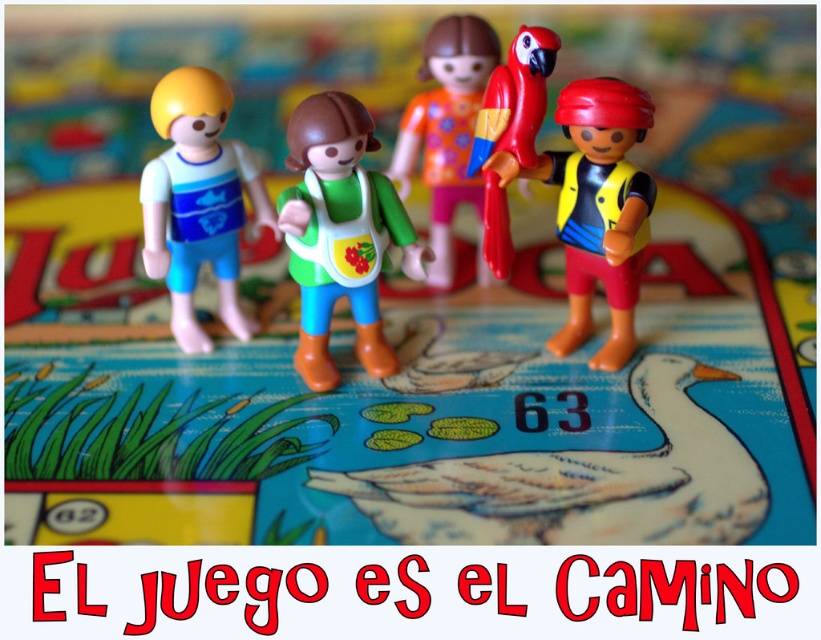
You are playing a board game and need to place a token between the green matte vest at center and the matte plastic doll at center. Which object should you place the token closer to if you want it to be nearer to the front of the scene?

The green matte vest at center is closer to the viewer than the matte plastic doll at center, so placing the token closer to the green matte vest at center will make it nearer to the front of the scene.